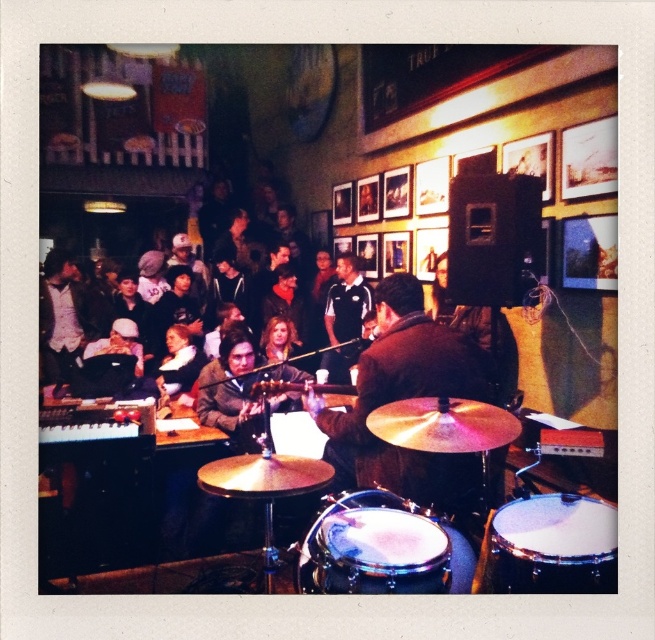
You are a stagehand setting up a new microphone stand. You need to place it between the shiny silver drum at center and the white drumhead at center. Which object should the microphone stand be closer to if it needs to be placed in front of both?

The microphone stand should be placed closer to the shiny silver drum at center because it is already in front of the white drumhead at center, so placing it in front of both would require positioning it in front of the shiny silver drum.

You are a photographer at the music venue and want to take a photo of the shiny brown jacket at center and the shiny silver drum at center. Which object should you focus on first if you want to capture both in the same frame without moving the camera?

The shiny brown jacket at center is positioned on the right side of the shiny silver drum at center, so you should focus on the shiny silver drum at center first to ensure both are in the frame.

You are a photographer setting up for a concert. You need to position a spotlight so it shines on both the shiny brown jacket at center and the white drumhead at center. Based on their positions, which object should you aim the spotlight towards first to ensure both are lit?

The shiny brown jacket at center is to the left of the white drumhead at center. To light both, aim the spotlight towards the shiny brown jacket at center first, then adjust to cover the white drumhead at center as it is to the right.